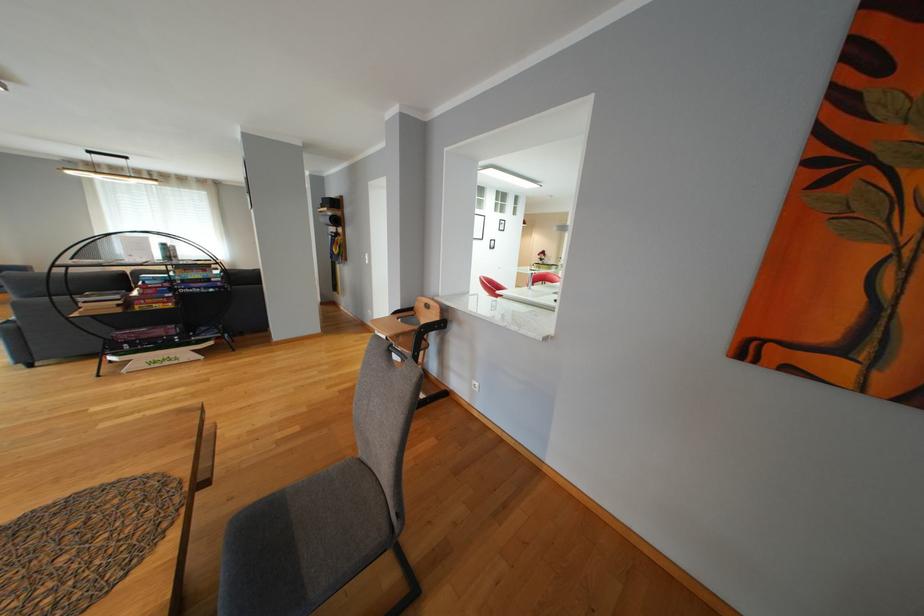
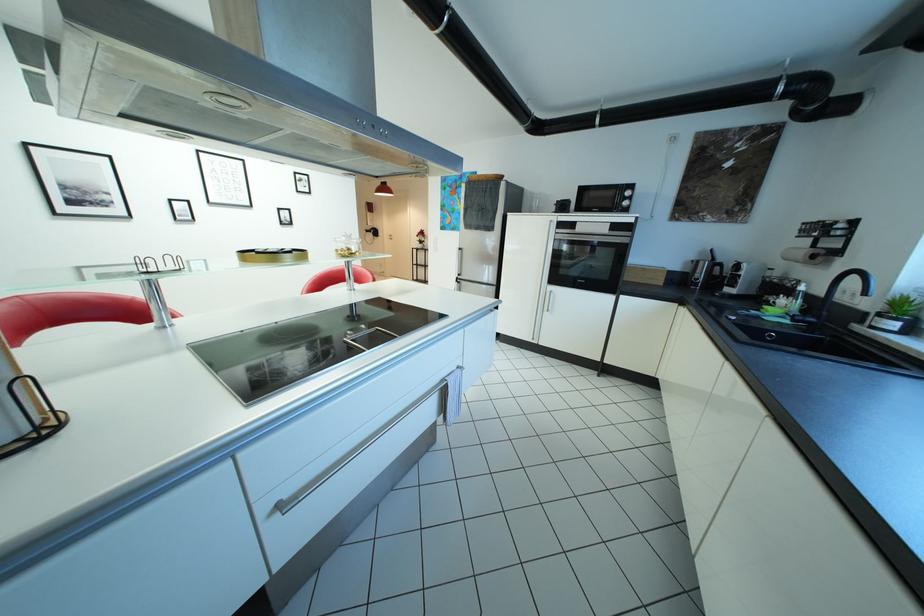
What movement of the cameraman would produce the second image?

The cameraman walked toward right, forward.